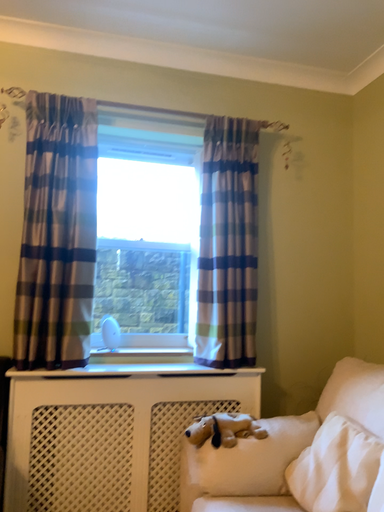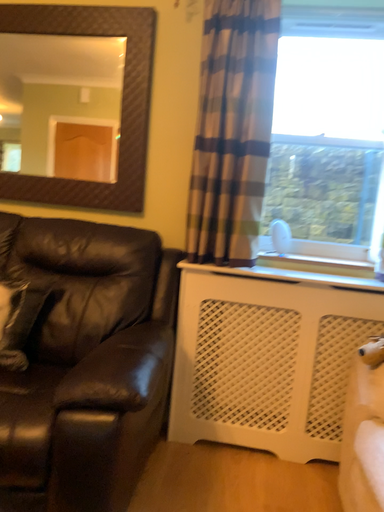
Question: How did the camera likely rotate when shooting the video?

Choices:
 (A) rotated upward
 (B) rotated downward

Answer: (B)